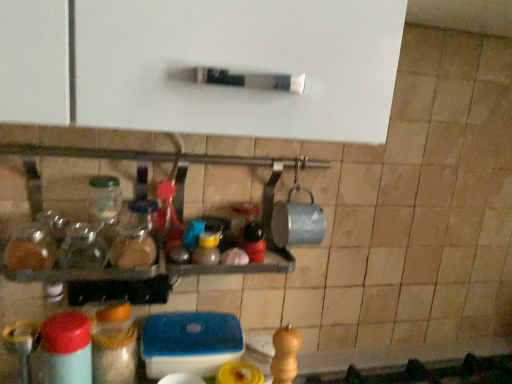
Question: Is translucent plastic container at lower center, acting as the 2th bottle starting from the top, looking in the opposite direction of matte plastic bottle at lower left, placed as the third bottle when sorted from top to bottom?

Choices:
 (A) no
 (B) yes

Answer: (A)

Question: Does translucent plastic container at lower center, acting as the 2th bottle starting from the top, have a lesser width compared to matte plastic bottle at lower left, the first bottle when ordered from bottom to top?

Choices:
 (A) no
 (B) yes

Answer: (A)

Question: Is translucent plastic container at lower center, the second bottle from the bottom, not near matte plastic bottle at lower left, the first bottle when ordered from bottom to top?

Choices:
 (A) yes
 (B) no

Answer: (B)

Question: Is translucent plastic container at lower center, acting as the 2th bottle starting from the top, positioned in front of matte plastic bottle at lower left, placed as the third bottle when sorted from top to bottom?

Choices:
 (A) no
 (B) yes

Answer: (A)

Question: Is translucent plastic container at lower center, acting as the 2th bottle starting from the top, to the left of matte plastic bottle at lower left, placed as the third bottle when sorted from top to bottom, from the viewer's perspective?

Choices:
 (A) no
 (B) yes

Answer: (A)

Question: Considering their positions, is matte plastic bottle at lower left, placed as the third bottle when sorted from top to bottom, located in front of or behind translucent plastic container at lower center, acting as the 2th bottle starting from the top?

Choices:
 (A) front
 (B) behind

Answer: (A)

Question: In terms of size, does matte plastic bottle at lower left, the first bottle when ordered from bottom to top, appear bigger or smaller than translucent plastic container at lower center, acting as the 2th bottle starting from the top?

Choices:
 (A) small
 (B) big

Answer: (B)

Question: From the image's perspective, is matte plastic bottle at lower left, placed as the third bottle when sorted from top to bottom, above or below translucent plastic container at lower center, the second bottle from the bottom?

Choices:
 (A) below
 (B) above

Answer: (A)

Question: In the image, is matte plastic bottle at lower left, the first bottle when ordered from bottom to top, on the left side or the right side of translucent plastic container at lower center, the second bottle from the bottom?

Choices:
 (A) left
 (B) right

Answer: (A)

Question: Considering the positions of point (117, 261) and point (121, 379), is point (117, 261) closer or farther from the camera than point (121, 379)?

Choices:
 (A) closer
 (B) farther

Answer: (A)

Question: In terms of height, does translucent glass jar at center, the 1th bottle viewed from the top, look taller or shorter compared to translucent plastic container at lower center, the second bottle from the bottom?

Choices:
 (A) tall
 (B) short

Answer: (B)

Question: Considering the relative positions of translucent glass jar at center, the 1th bottle viewed from the top, and translucent plastic container at lower center, the second bottle from the bottom, in the image provided, is translucent glass jar at center, the 1th bottle viewed from the top, to the left or to the right of translucent plastic container at lower center, the second bottle from the bottom,?

Choices:
 (A) right
 (B) left

Answer: (A)

Question: From a real-world perspective, is translucent glass jar at center, the 1th bottle viewed from the top, positioned above or below translucent plastic container at lower center, the second bottle from the bottom?

Choices:
 (A) above
 (B) below

Answer: (A)

Question: From the image's perspective, is matte plastic bottle at lower left, the first bottle when ordered from bottom to top, located above or below translucent glass jar at center, marked as the third bottle in a bottom-to-top arrangement?

Choices:
 (A) above
 (B) below

Answer: (B)

Question: From their relative heights in the image, would you say matte plastic bottle at lower left, placed as the third bottle when sorted from top to bottom, is taller or shorter than translucent glass jar at center, the 1th bottle viewed from the top?

Choices:
 (A) tall
 (B) short

Answer: (A)